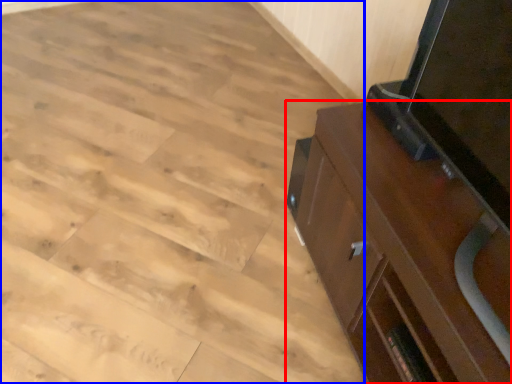
Question: Which object is further to the camera taking this photo, cabinetry (highlighted by a red box) or plywood (highlighted by a blue box)?

Choices:
 (A) cabinetry
 (B) plywood

Answer: (B)